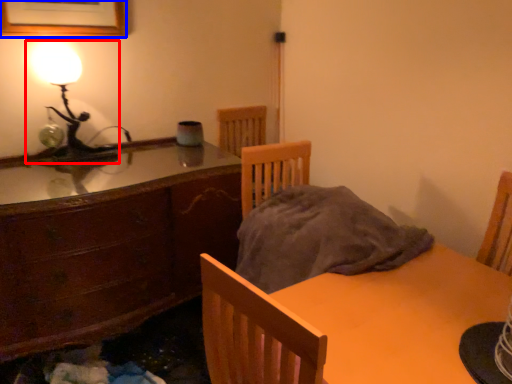
Question: Which object is closer to the camera taking this photo, lamp (highlighted by a red box) or picture frame (highlighted by a blue box)?

Choices:
 (A) lamp
 (B) picture frame

Answer: (B)